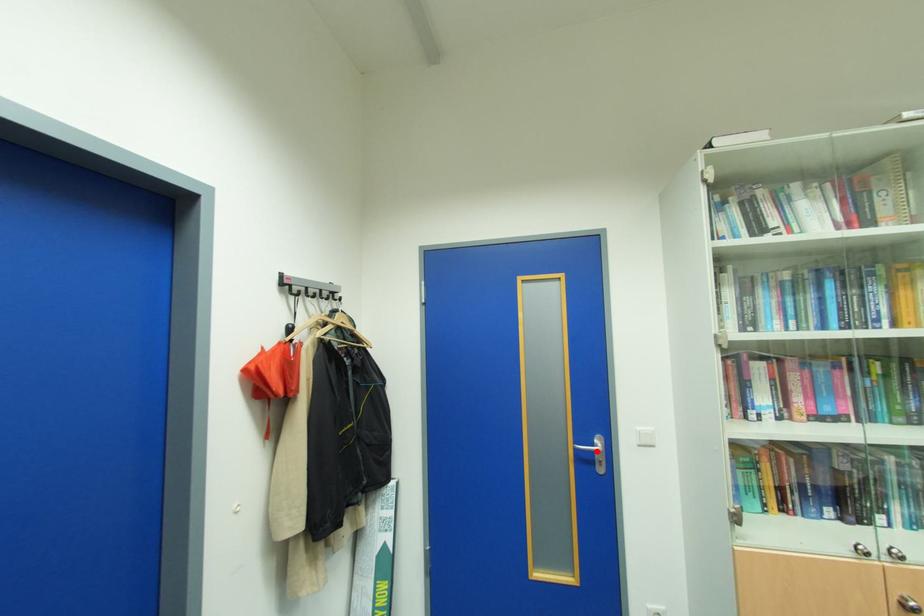
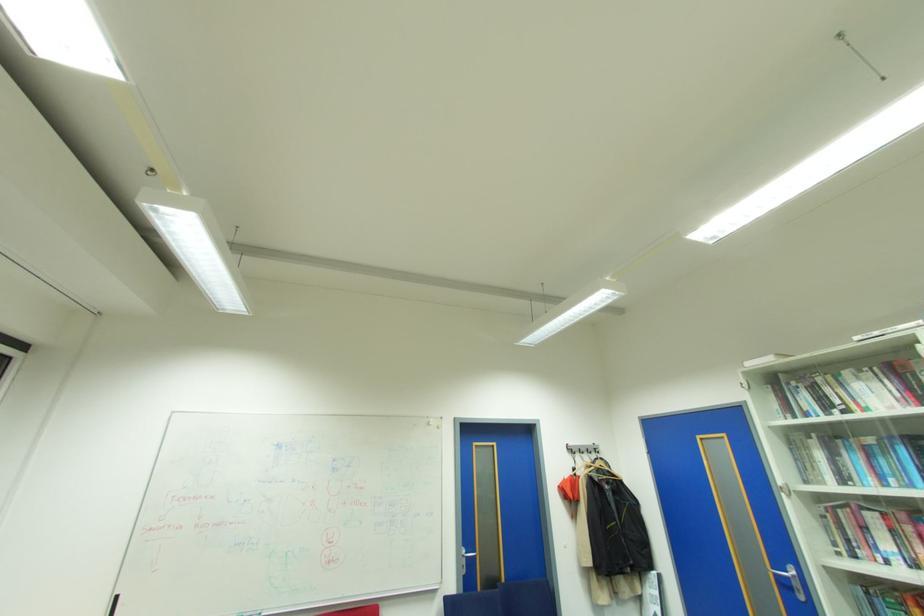
In the second image, find the point that corresponds to the highlighted location in the first image.

(791, 578)